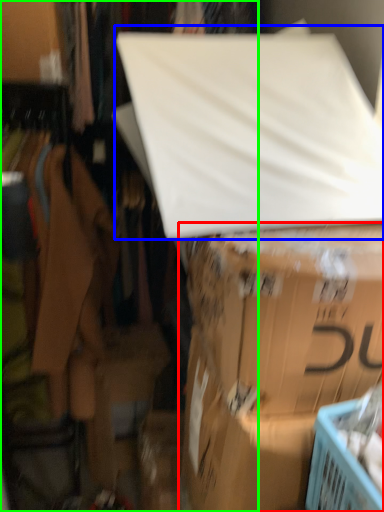
Question: Which object is the farthest from box (highlighted by a red box)? Choose among these: linen (highlighted by a blue box) or closet (highlighted by a green box).

Choices:
 (A) linen
 (B) closet

Answer: (B)